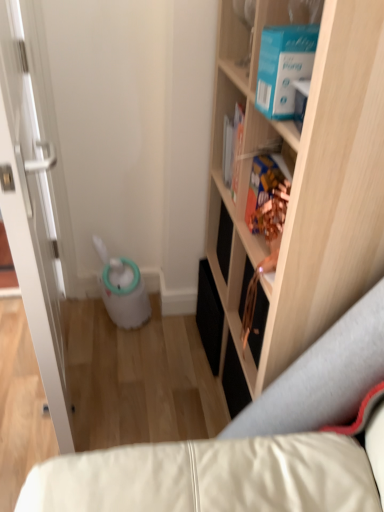
Question: Is white glossy door at left a part of multicolored cardboard book at upper right?

Choices:
 (A) no
 (B) yes

Answer: (A)

Question: From the image's perspective, is multicolored cardboard book at upper right beneath white glossy door at left?

Choices:
 (A) no
 (B) yes

Answer: (A)

Question: Can you confirm if multicolored cardboard book at upper right is taller than white glossy door at left?

Choices:
 (A) no
 (B) yes

Answer: (A)

Question: Is multicolored cardboard book at upper right completely or partially outside of white glossy door at left?

Choices:
 (A) yes
 (B) no

Answer: (A)

Question: Does multicolored cardboard book at upper right have a lesser height compared to white glossy door at left?

Choices:
 (A) no
 (B) yes

Answer: (B)

Question: Is multicolored cardboard book at upper right smaller than white glossy door at left?

Choices:
 (A) no
 (B) yes

Answer: (B)

Question: Could light wood cabinet at upper right be considered to be inside multicolored cardboard book at upper right?

Choices:
 (A) no
 (B) yes

Answer: (A)

Question: Considering the relative sizes of multicolored cardboard book at upper right and light wood cabinet at upper right in the image provided, is multicolored cardboard book at upper right bigger than light wood cabinet at upper right?

Choices:
 (A) yes
 (B) no

Answer: (B)

Question: Is multicolored cardboard book at upper right next to light wood cabinet at upper right and touching it?

Choices:
 (A) yes
 (B) no

Answer: (B)

Question: Considering the relative sizes of multicolored cardboard book at upper right and light wood cabinet at upper right in the image provided, is multicolored cardboard book at upper right smaller than light wood cabinet at upper right?

Choices:
 (A) yes
 (B) no

Answer: (A)

Question: Does multicolored cardboard book at upper right come in front of light wood cabinet at upper right?

Choices:
 (A) yes
 (B) no

Answer: (B)

Question: From the image's perspective, would you say multicolored cardboard book at upper right is shown under light wood cabinet at upper right?

Choices:
 (A) no
 (B) yes

Answer: (A)

Question: Does light wood cabinet at upper right appear on the left side of multicolored cardboard book at upper right?

Choices:
 (A) yes
 (B) no

Answer: (B)